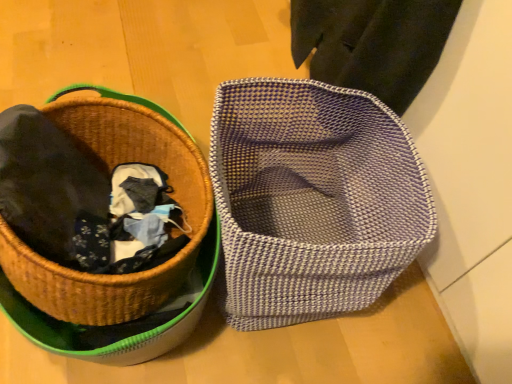
Question: Is woven brown picnic basket at left taller than textured woven basket at center?

Choices:
 (A) yes
 (B) no

Answer: (B)

Question: Does woven brown picnic basket at left have a larger size compared to textured woven basket at center?

Choices:
 (A) yes
 (B) no

Answer: (A)

Question: Can you confirm if woven brown picnic basket at left is wider than textured woven basket at center?

Choices:
 (A) yes
 (B) no

Answer: (A)

Question: Is the surface of woven brown picnic basket at left in direct contact with textured woven basket at center?

Choices:
 (A) no
 (B) yes

Answer: (A)

Question: Considering the relative sizes of woven brown picnic basket at left and textured woven basket at center in the image provided, is woven brown picnic basket at left shorter than textured woven basket at center?

Choices:
 (A) no
 (B) yes

Answer: (B)

Question: Is woven brown picnic basket at left not close to textured woven basket at center?

Choices:
 (A) no
 (B) yes

Answer: (A)

Question: Is woven brown picnic basket at left a part of textured woven basket at center?

Choices:
 (A) no
 (B) yes

Answer: (A)

Question: Is textured woven basket at center aimed at woven brown picnic basket at left?

Choices:
 (A) no
 (B) yes

Answer: (B)

Question: Is textured woven basket at center positioned in front of woven brown picnic basket at left?

Choices:
 (A) no
 (B) yes

Answer: (A)

Question: From a real-world perspective, is textured woven basket at center located higher than woven brown picnic basket at left?

Choices:
 (A) yes
 (B) no

Answer: (B)

Question: Does textured woven basket at center appear on the left side of woven brown picnic basket at left?

Choices:
 (A) no
 (B) yes

Answer: (A)

Question: Are textured woven basket at center and woven brown picnic basket at left far apart?

Choices:
 (A) yes
 (B) no

Answer: (B)

Question: Considering the positions of point (344, 294) and point (120, 291), is point (344, 294) closer or farther from the camera than point (120, 291)?

Choices:
 (A) closer
 (B) farther

Answer: (B)